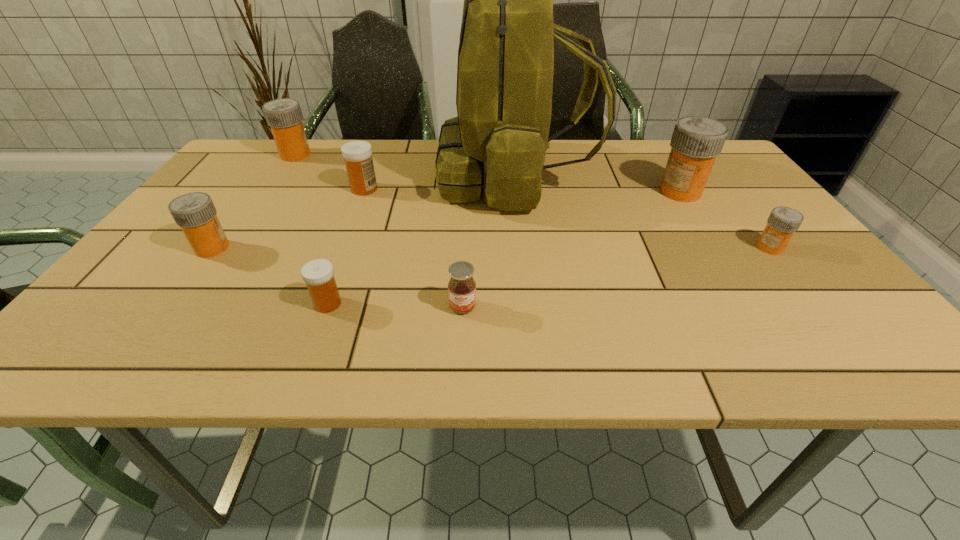
The width and height of the screenshot is (960, 540). Identify the location of empty location between the second tallest medicine and the third biggest orange medicine. (253, 201).

The image size is (960, 540). Find the location of `unoccupied position between the rightmost orange medicine and the second tallest object`. unoccupied position between the rightmost orange medicine and the second tallest object is located at coordinates (725, 220).

Image resolution: width=960 pixels, height=540 pixels. In order to click on vacant area between the backpack and the second object from right to left in this screenshot , I will do `click(597, 184)`.

The image size is (960, 540). Find the location of `free point between the farthest medicine and the third biggest orange medicine`. free point between the farthest medicine and the third biggest orange medicine is located at coordinates (253, 201).

This screenshot has height=540, width=960. Find the location of `object identified as the fifth closest to the third biggest orange medicine`. object identified as the fifth closest to the third biggest orange medicine is located at coordinates (461, 287).

Identify which object is the seventh nearest to the jam. Please provide its 2D coordinates. Your answer should be formatted as a tuple, i.e. [(x, y)], where the tuple contains the x and y coordinates of a point satisfying the conditions above.

[(284, 116)]

Find the location of a particular element. medicine object that ranks as the second closest to the rightmost medicine is located at coordinates (318, 274).

Select which medicine appears as the fourth closest to the rightmost object. Please provide its 2D coordinates. Your answer should be formatted as a tuple, i.e. [(x, y)], where the tuple contains the x and y coordinates of a point satisfying the conditions above.

[(195, 213)]

Select which orange medicine appears as the second closest to the second biggest orange medicine. Please provide its 2D coordinates. Your answer should be formatted as a tuple, i.e. [(x, y)], where the tuple contains the x and y coordinates of a point satisfying the conditions above.

[(696, 141)]

This screenshot has width=960, height=540. In order to click on orange medicine that can be found as the closest to the second smallest orange medicine in this screenshot , I will do [284, 116].